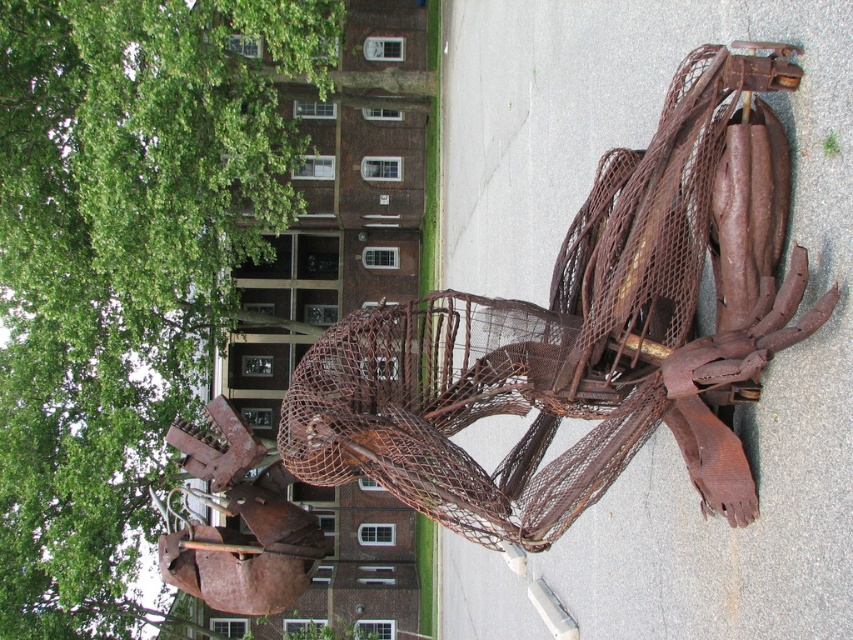
Question: Is green leafy tree at upper left above rusty wire mesh sculpture at center?

Choices:
 (A) yes
 (B) no

Answer: (A)

Question: Can you confirm if green leafy tree at upper left is positioned above rusty wire mesh sculpture at center?

Choices:
 (A) yes
 (B) no

Answer: (A)

Question: Among these objects, which one is farthest from the camera?

Choices:
 (A) rusty wire mesh sculpture at center
 (B) green leafy tree at upper left

Answer: (B)

Question: Which point is closer to the camera taking this photo?

Choices:
 (A) (706, 195)
 (B) (0, 497)

Answer: (A)

Question: Which point is closer to the camera?

Choices:
 (A) rusty wire mesh sculpture at center
 (B) green leafy tree at upper left

Answer: (A)

Question: Can you confirm if green leafy tree at upper left is positioned below rusty wire mesh sculpture at center?

Choices:
 (A) yes
 (B) no

Answer: (B)